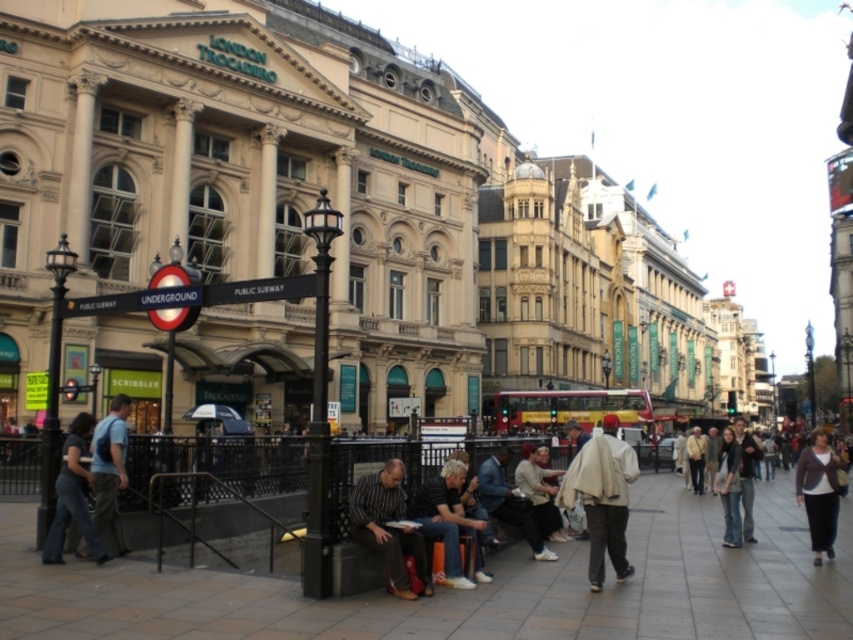
You are a delivery person trying to find the subway entrance marked by the black metal railing. You see a dark gray fabric jacket at center and a dark brown sweater at lower right. Which clothing item is closer to the subway entrance?

The dark brown sweater at lower right is closer to the subway entrance because it is located below the dark gray fabric jacket at center.

You are standing in front of the London Trocadero building and notice a white woolen coat at center. If you want to reach it quickly, how many steps do you think you would need to take, assuming each step covers about 0.76 meters?

The white woolen coat at center is 35.49 meters away from viewer. Since each step covers about 0.76 meters, you would need to take approximately 46.7 steps to reach it. However, this distance seems unusually large for an urban setting, so there might be a misunderstanding in the measurement provided.